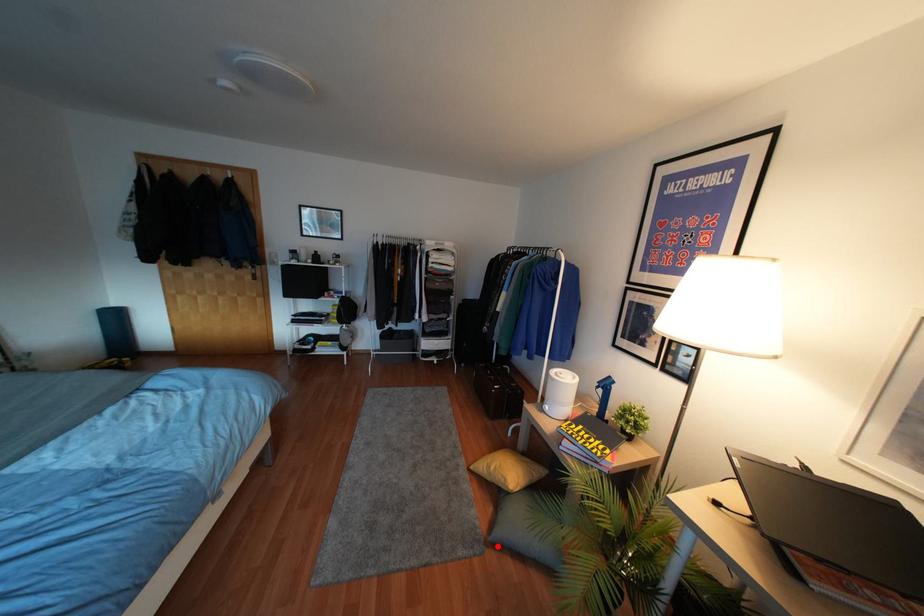
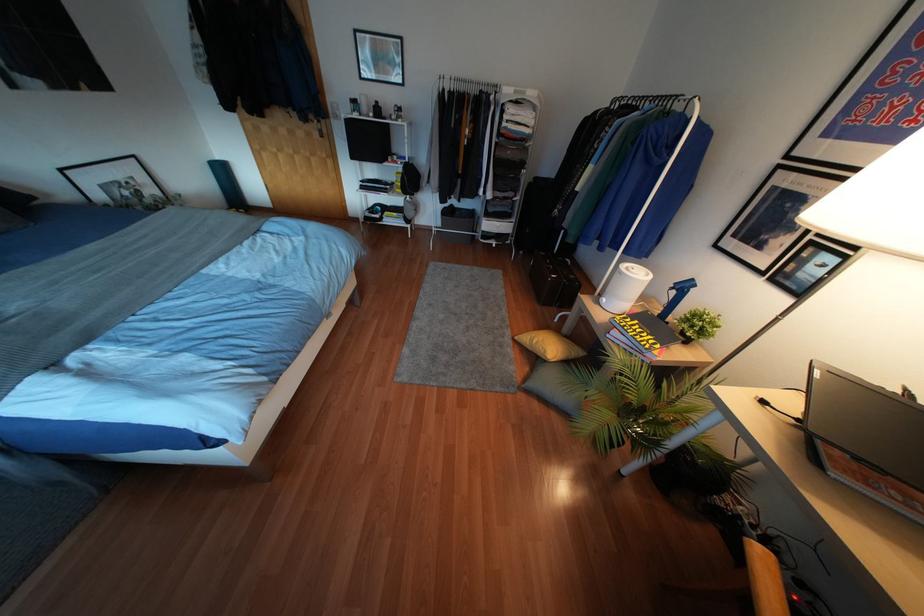
In the second image, find the point that corresponds to the highlighted location in the first image.

(528, 392)